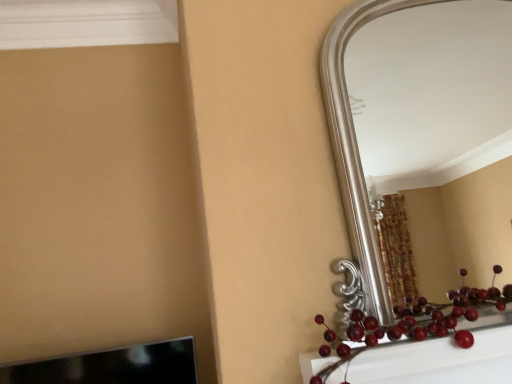
Question: In terms of size, does silver metallic mirror at upper right appear bigger or smaller than glossy red berries at lower right?

Choices:
 (A) big
 (B) small

Answer: (A)

Question: Do you think silver metallic mirror at upper right is within glossy red berries at lower right, or outside of it?

Choices:
 (A) outside
 (B) inside

Answer: (A)

Question: Is silver metallic mirror at upper right taller or shorter than glossy red berries at lower right?

Choices:
 (A) tall
 (B) short

Answer: (A)

Question: In the image, is glossy red berries at lower right on the left side or the right side of silver metallic mirror at upper right?

Choices:
 (A) right
 (B) left

Answer: (B)

Question: In the image, is glossy red berries at lower right positioned in front of or behind silver metallic mirror at upper right?

Choices:
 (A) front
 (B) behind

Answer: (A)

Question: From the image's perspective, relative to silver metallic mirror at upper right, is glossy red berries at lower right above or below?

Choices:
 (A) above
 (B) below

Answer: (B)

Question: Does point (495, 324) appear closer or farther from the camera than point (401, 180)?

Choices:
 (A) closer
 (B) farther

Answer: (A)